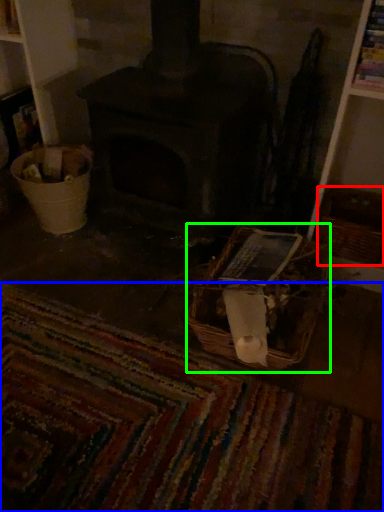
Question: Based on their relative distances, which object is farther from basket (highlighted by a red box)? Choose from mat (highlighted by a blue box) and basket (highlighted by a green box).

Choices:
 (A) mat
 (B) basket

Answer: (A)